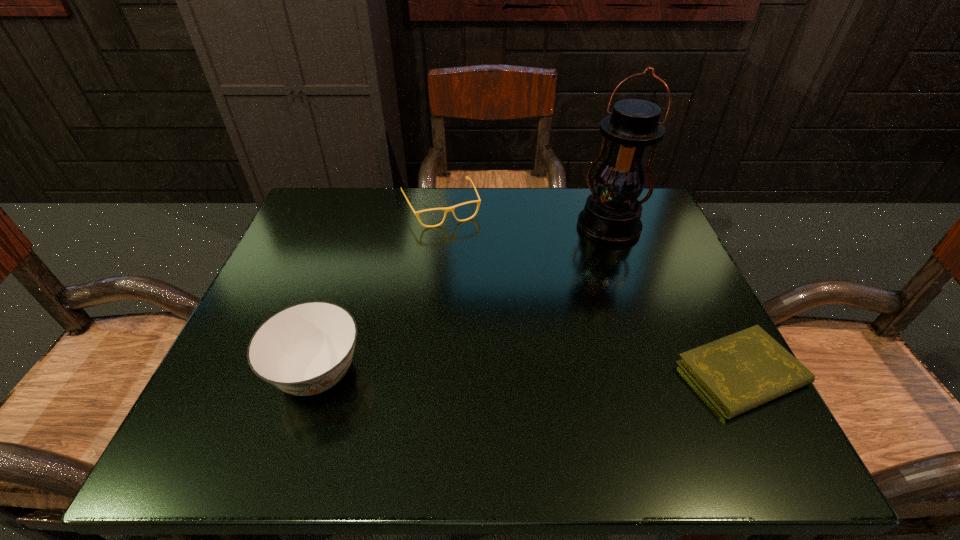
Find the location of a particular element. vacant area that lies between the shortest object and the lantern is located at coordinates (675, 300).

Locate an element on the screen. free spot between the second shortest object and the diary is located at coordinates (591, 291).

The image size is (960, 540). I want to click on blank region between the tallest object and the soup bowl, so click(464, 300).

This screenshot has height=540, width=960. In order to click on unoccupied area between the soup bowl and the spectacles in this screenshot , I will do `click(379, 291)`.

Where is `unoccupied position between the shortest object and the tallest object`? The height and width of the screenshot is (540, 960). unoccupied position between the shortest object and the tallest object is located at coordinates (675, 300).

You are a GUI agent. You are given a task and a screenshot of the screen. Output one action in this format:
    pyautogui.click(x=<x>, y=<y>)
    Task: Click on the free space that is in between the lantern and the shortest object
    Image resolution: width=960 pixels, height=540 pixels.
    Given the screenshot: What is the action you would take?
    pyautogui.click(x=675, y=300)

Find the location of a particular element. blank region between the spectacles and the soup bowl is located at coordinates (379, 291).

This screenshot has height=540, width=960. I want to click on object that is the closest one to the spectacles, so click(611, 215).

Locate which object ranks in proximity to the second tallest object. Please provide its 2D coordinates. Your answer should be formatted as a tuple, i.e. [(x, y)], where the tuple contains the x and y coordinates of a point satisfying the conditions above.

[(447, 209)]

Find the location of a particular element. The image size is (960, 540). vacant region that satisfies the following two spatial constraints: 1. on the back side of the soup bowl; 2. on the right side of the second shortest object is located at coordinates pyautogui.click(x=371, y=207).